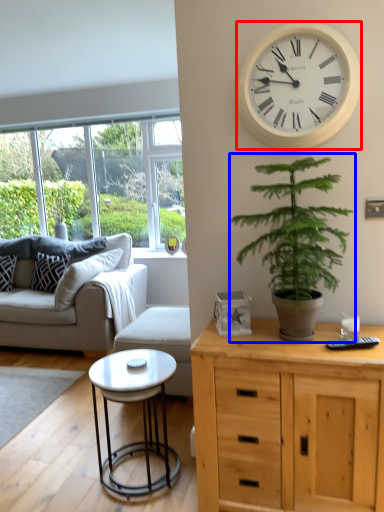
Question: Which object is further to the camera taking this photo, wall clock (highlighted by a red box) or houseplant (highlighted by a blue box)?

Choices:
 (A) wall clock
 (B) houseplant

Answer: (A)